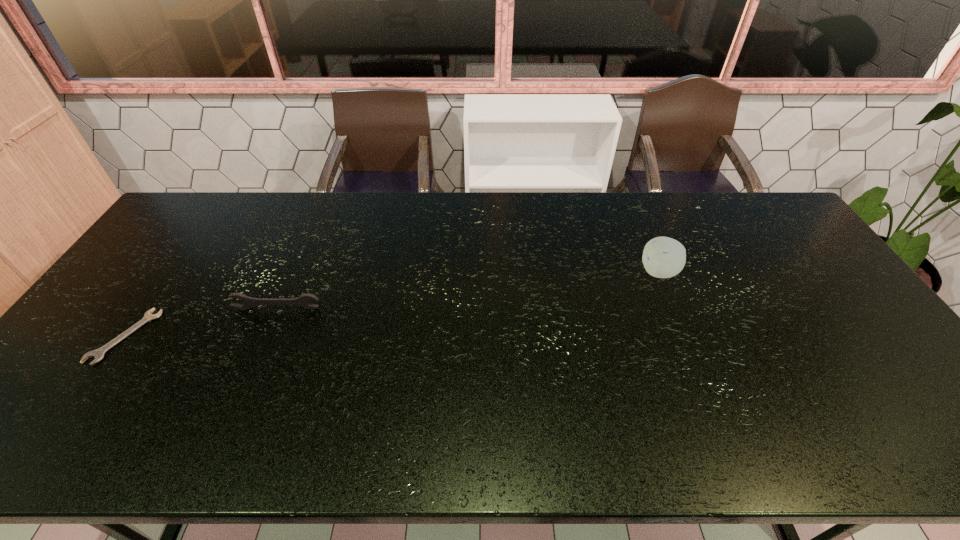
Where is `free spot between the taller wrench and the shortest object`? free spot between the taller wrench and the shortest object is located at coordinates (201, 322).

Locate an element on the screen. The width and height of the screenshot is (960, 540). empty space between the rightmost object and the shorter wrench is located at coordinates (392, 304).

This screenshot has width=960, height=540. I want to click on free space between the taller wrench and the shortest object, so click(x=201, y=322).

Image resolution: width=960 pixels, height=540 pixels. Identify the location of empty space that is in between the tallest object and the second object from right to left. (468, 291).

Point out which object is positioned as the nearest to the tallest object. Please provide its 2D coordinates. Your answer should be formatted as a tuple, i.e. [(x, y)], where the tuple contains the x and y coordinates of a point satisfying the conditions above.

[(302, 301)]

Identify the location of the second closest object to the rightmost object. The image size is (960, 540). (98, 354).